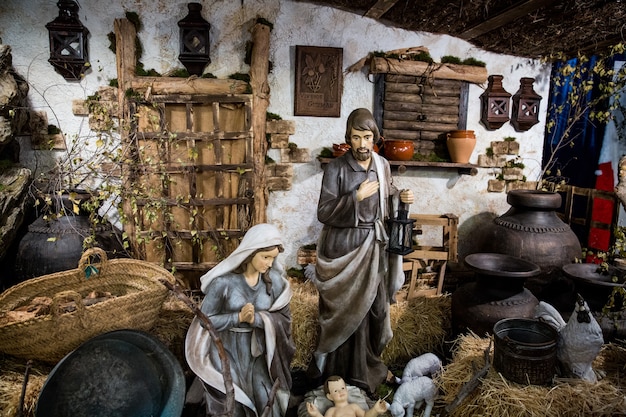
Find the location of `wood blind`. wood blind is located at coordinates (446, 83), (436, 90), (436, 99), (436, 107), (434, 117), (433, 123), (429, 133), (428, 140), (428, 149).